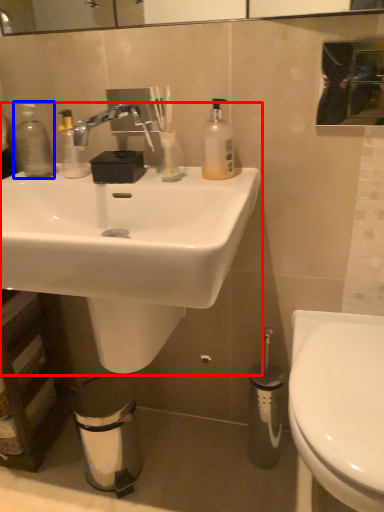
Question: Among these objects, which one is farthest to the camera, sink (highlighted by a red box) or bottle (highlighted by a blue box)?

Choices:
 (A) sink
 (B) bottle

Answer: (B)